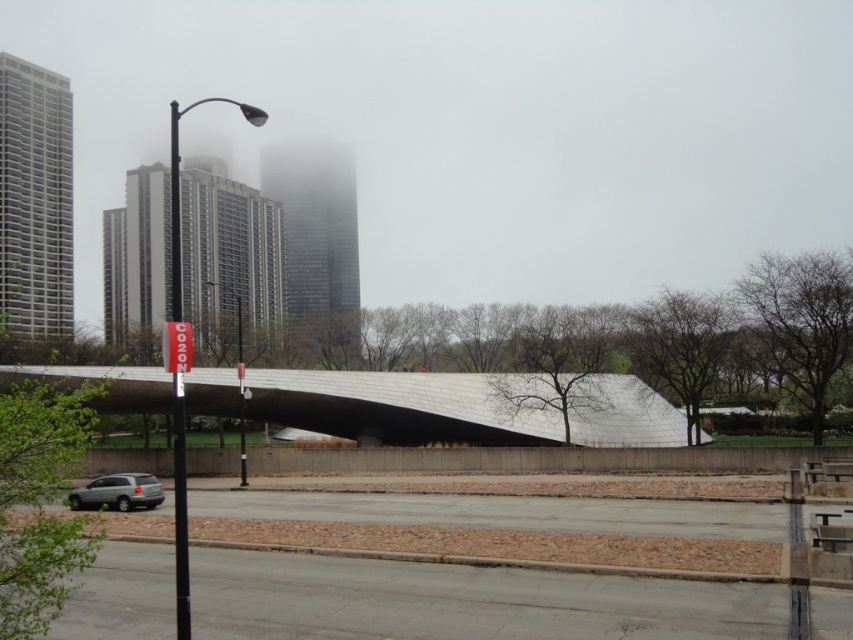
Question: Which point is closer to the camera?

Choices:
 (A) (215, 387)
 (B) (152, 492)

Answer: (B)

Question: Does silver metallic overpass at center appear on the right side of silver metallic suv at lower left?

Choices:
 (A) no
 (B) yes

Answer: (B)

Question: Is silver metallic overpass at center to the right of silver metallic suv at lower left from the viewer's perspective?

Choices:
 (A) yes
 (B) no

Answer: (A)

Question: Where is silver metallic overpass at center located in relation to silver metallic suv at lower left in the image?

Choices:
 (A) left
 (B) right

Answer: (B)

Question: Which point is farther to the camera?

Choices:
 (A) silver metallic suv at lower left
 (B) silver metallic overpass at center

Answer: (B)

Question: Which of the following is the farthest from the observer?

Choices:
 (A) silver metallic suv at lower left
 (B) silver metallic overpass at center

Answer: (B)